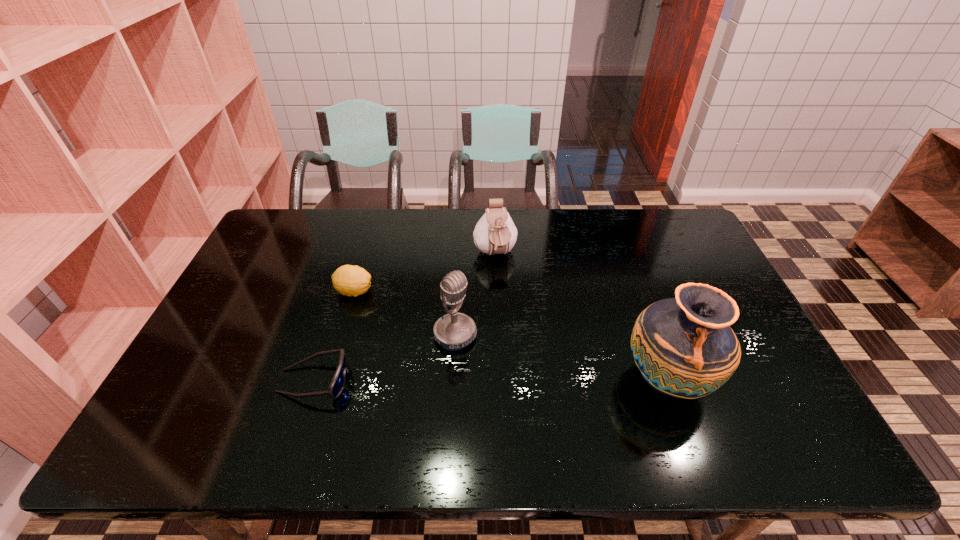
I want to click on vacant region located 0.350m on the front-facing side of the farthest object, so [524, 361].

Find the location of `free region located 0.100m on the front-facing side of the farthest object`. free region located 0.100m on the front-facing side of the farthest object is located at coordinates (505, 294).

Where is `free space located 0.170m on the front-facing side of the farthest object`? free space located 0.170m on the front-facing side of the farthest object is located at coordinates (510, 310).

Image resolution: width=960 pixels, height=540 pixels. Find the location of `free space located 0.330m at the stem end of the lemon`. free space located 0.330m at the stem end of the lemon is located at coordinates (457, 347).

In order to click on free region located at the stem end of the lemon in this screenshot , I will do `click(451, 343)`.

You are a GUI agent. You are given a task and a screenshot of the screen. Output one action in this format:
    pyautogui.click(x=<x>, y=<y>)
    Task: Click on the vacant position located 0.050m at the stem end of the lemon
    This screenshot has height=540, width=960.
    Given the screenshot: What is the action you would take?
    pyautogui.click(x=381, y=305)

The height and width of the screenshot is (540, 960). Find the location of `free space located 0.200m on the front-facing side of the microphone`. free space located 0.200m on the front-facing side of the microphone is located at coordinates tap(525, 395).

At what (x,y) coordinates should I click in order to perform the action: click on vacant area located 0.240m on the front-facing side of the microphone. Please return your answer as a coordinate pair (x, y). This screenshot has height=540, width=960. Looking at the image, I should click on (538, 405).

Where is `vacant space located 0.200m on the front-facing side of the microphone`? vacant space located 0.200m on the front-facing side of the microphone is located at coordinates 525,395.

Where is `object located in the far edge section of the desktop`? The height and width of the screenshot is (540, 960). object located in the far edge section of the desktop is located at coordinates (495, 233).